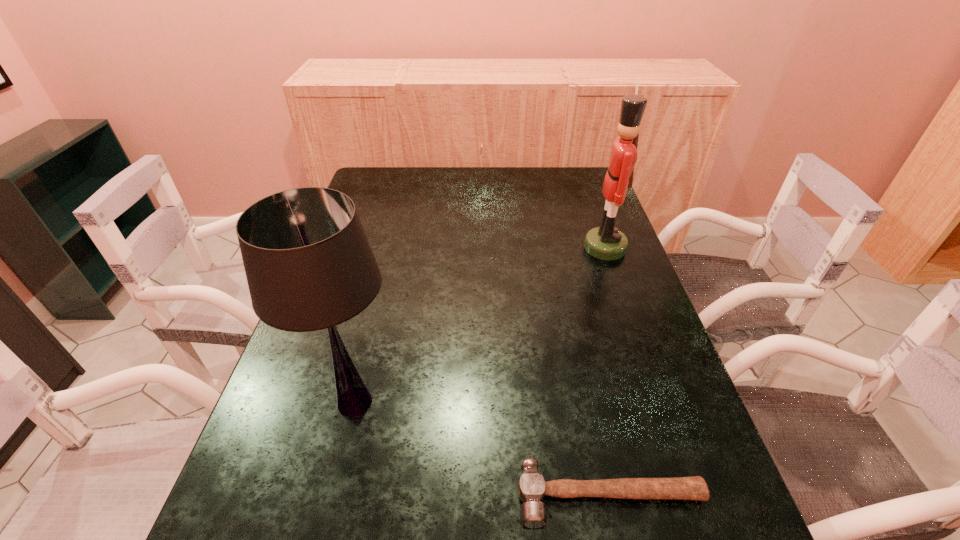
Identify the location of free location that satisfies the following two spatial constraints: 1. on the front-facing side of the nutcracker; 2. on the front-facing side of the second nearest object. (659, 402).

At what (x,y) coordinates should I click in order to perform the action: click on free region that satisfies the following two spatial constraints: 1. on the front-facing side of the nutcracker; 2. on the striking face of the shortest object. Please return your answer as a coordinate pair (x, y). This screenshot has height=540, width=960. Looking at the image, I should click on (691, 495).

The image size is (960, 540). I want to click on blank space that satisfies the following two spatial constraints: 1. on the front-facing side of the farthest object; 2. on the front-facing side of the leftmost object, so click(x=659, y=402).

Where is `vacant space that satisfies the following two spatial constraints: 1. on the front-facing side of the farthest object; 2. on the front-facing side of the second nearest object`? This screenshot has width=960, height=540. vacant space that satisfies the following two spatial constraints: 1. on the front-facing side of the farthest object; 2. on the front-facing side of the second nearest object is located at coordinates (659, 402).